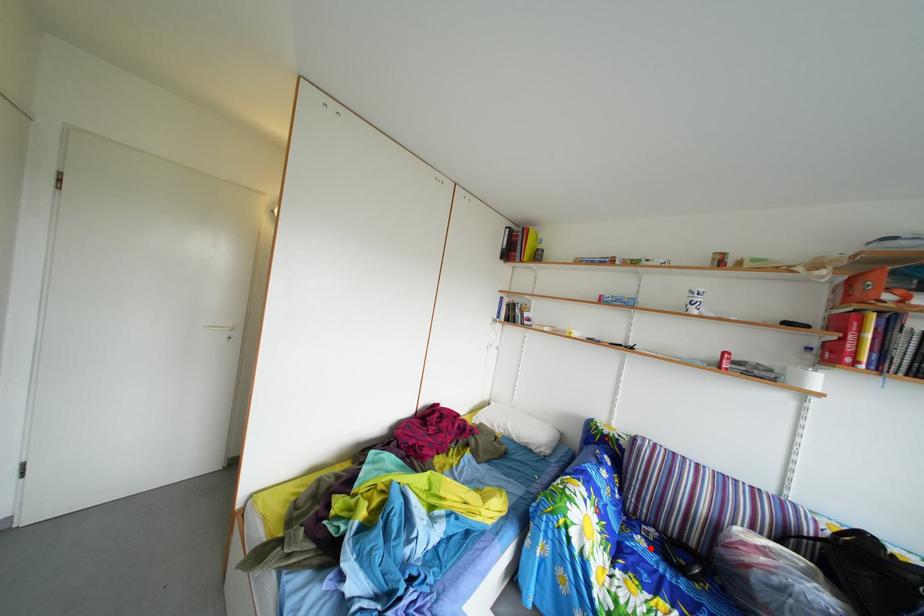
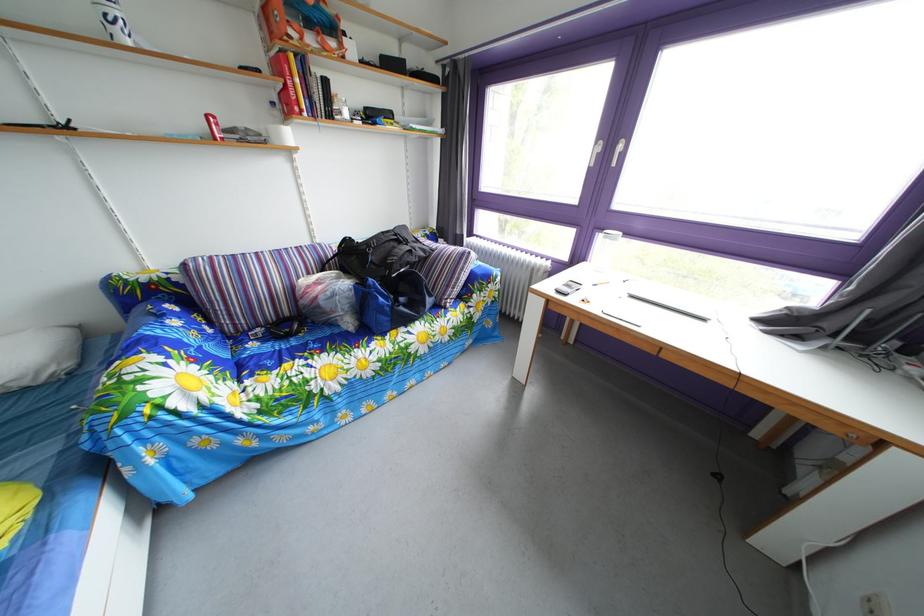
In the second image, find the point that corresponds to the highlighted location in the first image.

(262, 353)